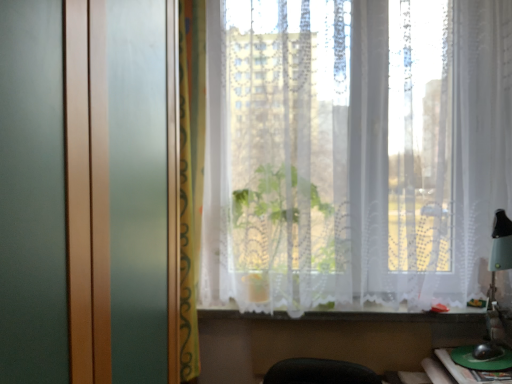
Question: Which direction should I rotate to look at yellow fabric curtain at center, placed as the 2th curtain when sorted from right to left, — up or down?

Choices:
 (A) down
 (B) up

Answer: (B)

Question: Considering the relative positions of white lace curtain at lower center and yellow fabric curtain at center, which is counted as the 1th curtain, starting from the left, in the image provided, is white lace curtain at lower center behind yellow fabric curtain at center, which is counted as the 1th curtain, starting from the left,?

Choices:
 (A) yes
 (B) no

Answer: (A)

Question: Can you confirm if white lace curtain at lower center is positioned to the left of yellow fabric curtain at center, which is counted as the 1th curtain, starting from the left?

Choices:
 (A) yes
 (B) no

Answer: (B)

Question: Considering the relative positions of white lace curtain at lower center and yellow fabric curtain at center, placed as the 2th curtain when sorted from right to left, in the image provided, is white lace curtain at lower center in front of yellow fabric curtain at center, placed as the 2th curtain when sorted from right to left,?

Choices:
 (A) no
 (B) yes

Answer: (A)

Question: From the image's perspective, is white lace curtain at lower center located above yellow fabric curtain at center, placed as the 2th curtain when sorted from right to left?

Choices:
 (A) no
 (B) yes

Answer: (A)

Question: Is white lace curtain at lower center looking in the opposite direction of yellow fabric curtain at center, placed as the 2th curtain when sorted from right to left?

Choices:
 (A) no
 (B) yes

Answer: (A)

Question: Is white lace curtain at lower center next to yellow fabric curtain at center, placed as the 2th curtain when sorted from right to left, and touching it?

Choices:
 (A) no
 (B) yes

Answer: (A)

Question: Does yellow fabric curtain at center, which is counted as the 1th curtain, starting from the left, have a smaller size compared to white lace curtain at lower center?

Choices:
 (A) yes
 (B) no

Answer: (B)

Question: Is yellow fabric curtain at center, which is counted as the 1th curtain, starting from the left, taller than white lace curtain at lower center?

Choices:
 (A) no
 (B) yes

Answer: (B)

Question: Does yellow fabric curtain at center, which is counted as the 1th curtain, starting from the left, have a lesser width compared to white lace curtain at lower center?

Choices:
 (A) yes
 (B) no

Answer: (B)

Question: Does yellow fabric curtain at center, which is counted as the 1th curtain, starting from the left, appear on the left side of white lace curtain at lower center?

Choices:
 (A) yes
 (B) no

Answer: (A)

Question: From a real-world perspective, does yellow fabric curtain at center, placed as the 2th curtain when sorted from right to left, sit lower than white lace curtain at lower center?

Choices:
 (A) yes
 (B) no

Answer: (B)

Question: Is yellow fabric curtain at center, placed as the 2th curtain when sorted from right to left, shorter than white lace curtain at lower center?

Choices:
 (A) yes
 (B) no

Answer: (B)

Question: From a real-world perspective, is white lace curtain at center, the 1th curtain viewed from the right, located beneath white lace curtain at lower center?

Choices:
 (A) no
 (B) yes

Answer: (A)